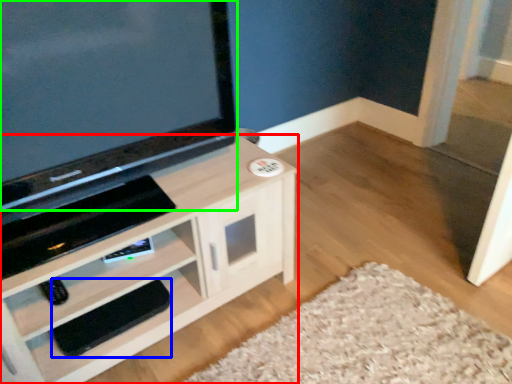
Question: Which object is the closest to the cabinetry (highlighted by a red box)? Choose among these: footrest (highlighted by a blue box) or television (highlighted by a green box).

Choices:
 (A) footrest
 (B) television

Answer: (A)